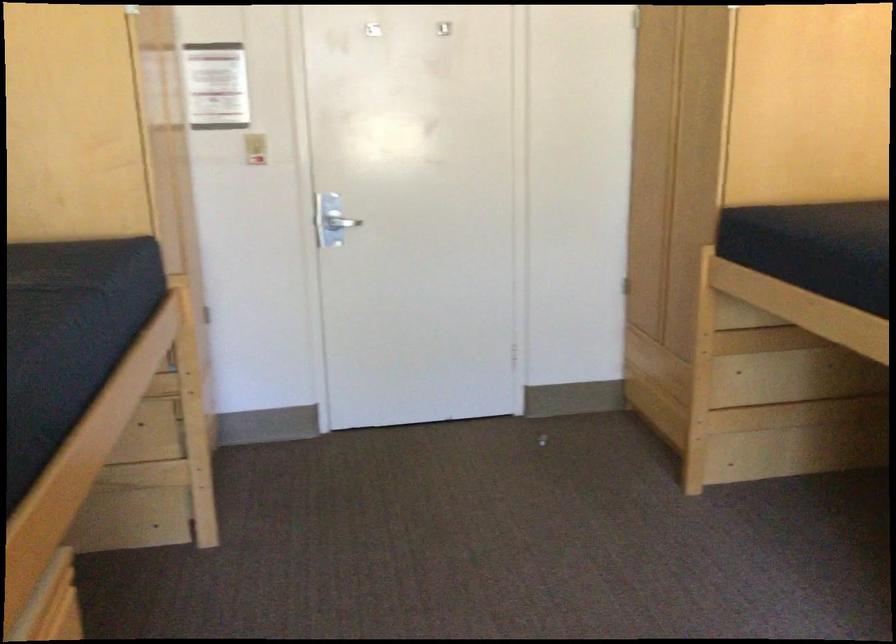
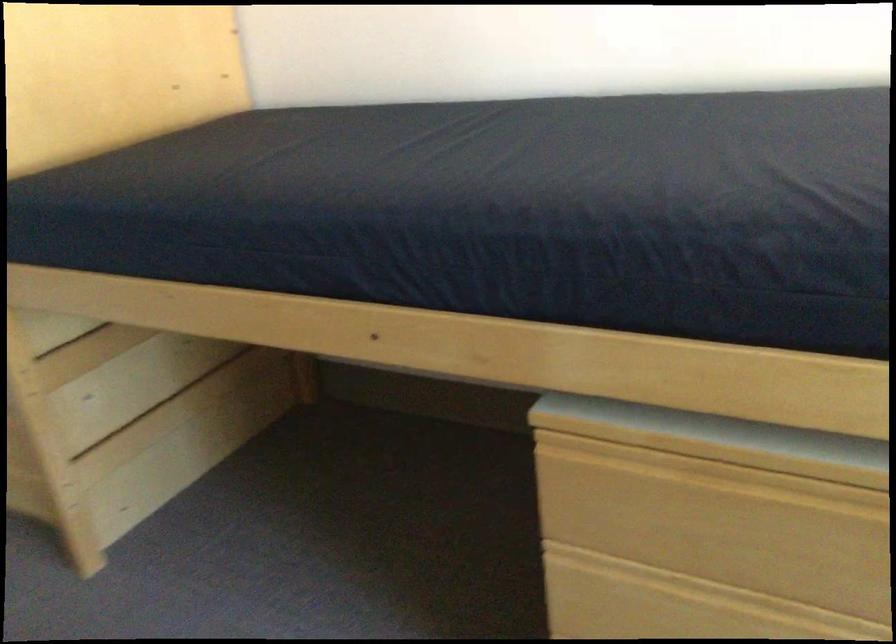
The point at (805, 442) is marked in the first image. Where is the corresponding point in the second image?

(195, 444)